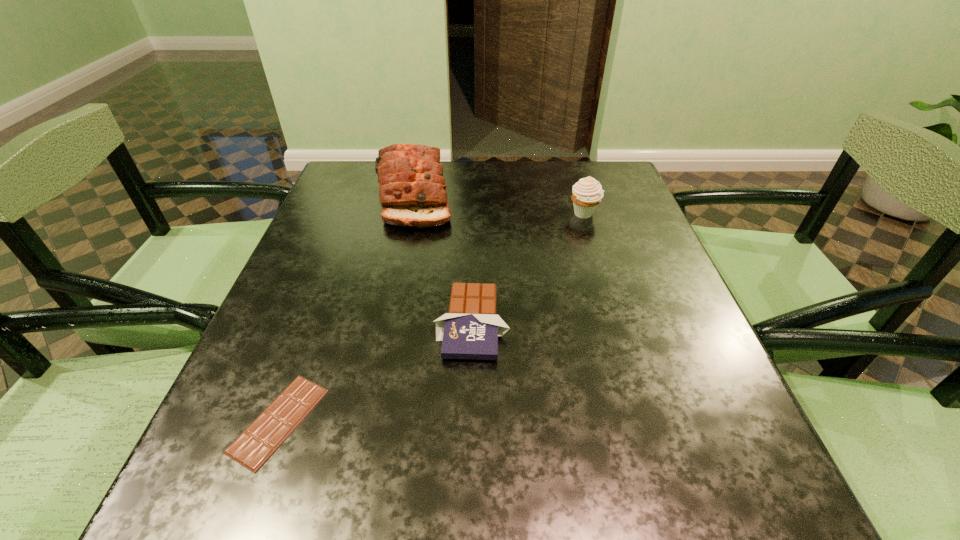
Where is `bread`? bread is located at coordinates (412, 192).

This screenshot has width=960, height=540. I want to click on muffin, so click(x=587, y=193).

Image resolution: width=960 pixels, height=540 pixels. Identify the location of the right chocolate bar. (470, 330).

This screenshot has height=540, width=960. Find the location of `the third farthest object`. the third farthest object is located at coordinates (470, 330).

This screenshot has height=540, width=960. What are the coordinates of `the shortest object` in the screenshot? It's located at (268, 431).

Where is `the left chocolate bar`? The height and width of the screenshot is (540, 960). the left chocolate bar is located at coordinates (268, 431).

This screenshot has height=540, width=960. I want to click on vacant area situated on the front of the bread, so click(x=403, y=248).

You are a GUI agent. You are given a task and a screenshot of the screen. Output one action in this format:
    pyautogui.click(x=<x>, y=<y>)
    Task: Click on the vacant area situated on the front of the muffin
    Image resolution: width=960 pixels, height=540 pixels.
    Given the screenshot: What is the action you would take?
    click(619, 326)

This screenshot has height=540, width=960. Find the location of `free space located on the left of the second shortest object`. free space located on the left of the second shortest object is located at coordinates (289, 323).

Find the location of `free space located 0.190m on the back of the shortest object`. free space located 0.190m on the back of the shortest object is located at coordinates (325, 295).